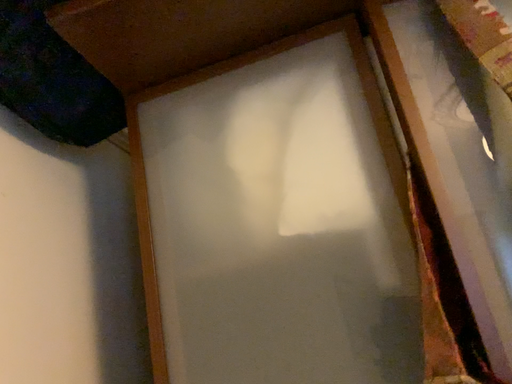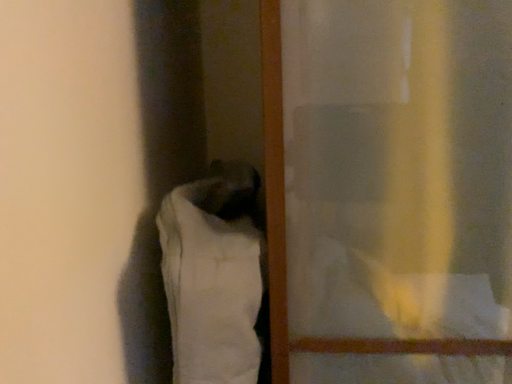
Question: How did the camera likely rotate when shooting the video?

Choices:
 (A) rotated downward
 (B) rotated upward

Answer: (A)